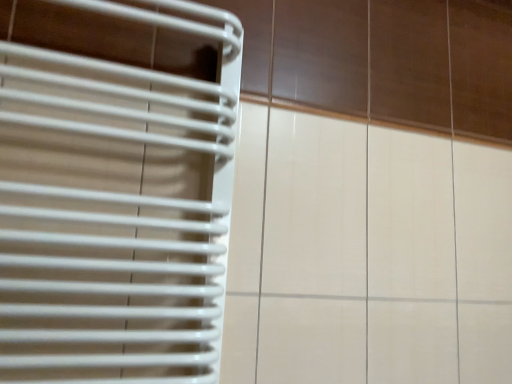
Locate an element on the screen. This screenshot has height=384, width=512. white plastic window blind at left is located at coordinates 115,189.

What do you see at coordinates (115, 189) in the screenshot? The height and width of the screenshot is (384, 512). I see `white plastic window blind at left` at bounding box center [115, 189].

Identify the location of white plastic window blind at left. Image resolution: width=512 pixels, height=384 pixels. (115, 189).